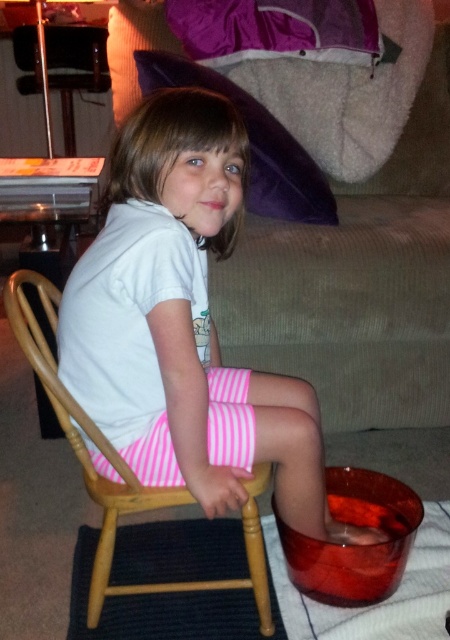
You are a guest in this living room and want to sit down. You see the white cotton shirt at center and the wooden rocking chair at center. Which object is closer to you?

The wooden rocking chair at center is behind the white cotton shirt at center, so the white cotton shirt at center is closer to you.

You are planning to place a new coffee table in front of the beige corduroy couch at center and the wooden rocking chair at center. Based on their widths, which piece of furniture should the coffee table be placed closer to?

The coffee table should be placed closer to the wooden rocking chair at center because the beige corduroy couch at center is wider than the wooden rocking chair at center, so the rocking chair requires less space and the table can be positioned nearer to it.

You are a delivery person standing in front of the living room door. You need to place a package on the white cotton shirt at center. Can you reach it without moving any furniture?

The white cotton shirt at center is 93.79 centimeters away from viewer. Since the delivery person is standing at the door, they can likely reach the shirt by extending their arm as it is within a reasonable distance without needing to move furniture.